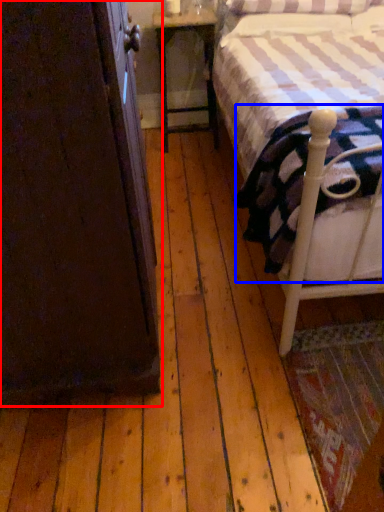
Question: Which point is further to the camera, armoire (highlighted by a red box) or mattress (highlighted by a blue box)?

Choices:
 (A) armoire
 (B) mattress

Answer: (B)